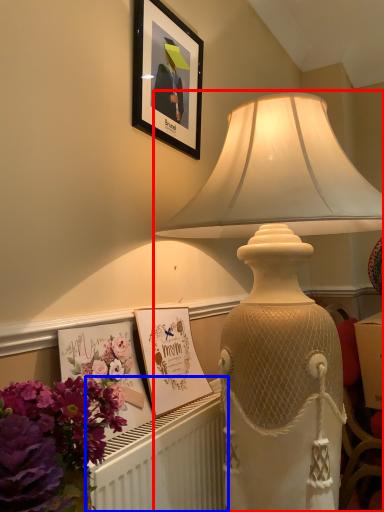
Question: Which object is further to the camera taking this photo, lamp (highlighted by a red box) or radiator (highlighted by a blue box)?

Choices:
 (A) lamp
 (B) radiator

Answer: (B)